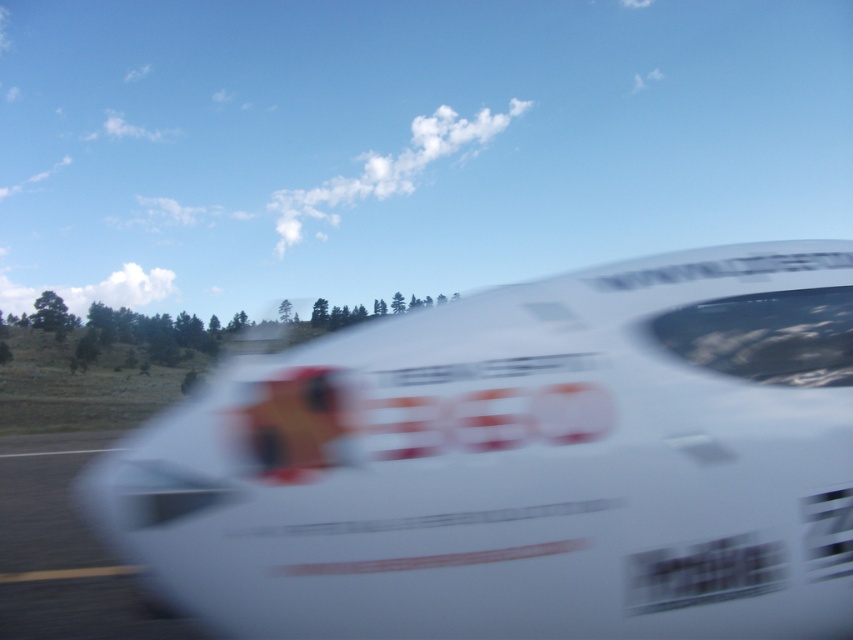
You are a pilot trying to land your plane on the runway. You see the white glossy airplane at center and the white glossy race track at lower left. Which object is larger and should you consider for safe landing?

The white glossy airplane at center is bigger than the white glossy race track at lower left. Therefore, you should consider the size of the white glossy airplane at center to ensure safe landing, as it may obstruct the runway.

You are a drone operator trying to capture aerial footage of the white glossy airplane at center and the white glossy race track at lower left. From your current position, which object is located to the right of the other?

The white glossy airplane at center is positioned on the right side of white glossy race track at lower left.